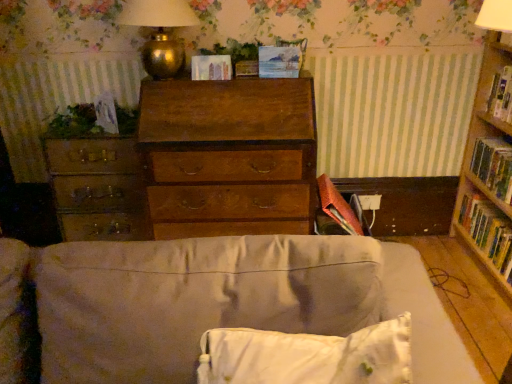
Question: Is white soft pillow at lower center taller than wooden file cabinet at left?

Choices:
 (A) yes
 (B) no

Answer: (B)

Question: Considering the relative sizes of white soft pillow at lower center and wooden file cabinet at left in the image provided, is white soft pillow at lower center bigger than wooden file cabinet at left?

Choices:
 (A) no
 (B) yes

Answer: (A)

Question: Is white soft pillow at lower center at the right side of wooden file cabinet at left?

Choices:
 (A) yes
 (B) no

Answer: (A)

Question: From the image's perspective, does white soft pillow at lower center appear lower than wooden file cabinet at left?

Choices:
 (A) yes
 (B) no

Answer: (A)

Question: Is white soft pillow at lower center to the left of wooden file cabinet at left from the viewer's perspective?

Choices:
 (A) yes
 (B) no

Answer: (B)

Question: In the image, is white soft pillow at lower center on the left side or the right side of wooden file cabinet at left?

Choices:
 (A) right
 (B) left

Answer: (A)

Question: From their relative heights in the image, would you say white soft pillow at lower center is taller or shorter than wooden file cabinet at left?

Choices:
 (A) tall
 (B) short

Answer: (B)

Question: Do you think white soft pillow at lower center is within wooden file cabinet at left, or outside of it?

Choices:
 (A) outside
 (B) inside

Answer: (A)

Question: From a real-world perspective, is white soft pillow at lower center physically located above or below wooden file cabinet at left?

Choices:
 (A) above
 (B) below

Answer: (A)

Question: From a real-world perspective, is gold metallic table lamp at upper center physically located above or below white soft pillow at lower center?

Choices:
 (A) above
 (B) below

Answer: (A)

Question: Is gold metallic table lamp at upper center situated inside white soft pillow at lower center or outside?

Choices:
 (A) inside
 (B) outside

Answer: (B)

Question: From the image's perspective, is gold metallic table lamp at upper center above or below white soft pillow at lower center?

Choices:
 (A) below
 (B) above

Answer: (B)

Question: From their relative heights in the image, would you say gold metallic table lamp at upper center is taller or shorter than white soft pillow at lower center?

Choices:
 (A) tall
 (B) short

Answer: (A)

Question: From the image's perspective, is matte paper at center, placed as the 2th paperback book when sorted from bottom to top, positioned above or below wooden chest of drawers at center?

Choices:
 (A) above
 (B) below

Answer: (A)

Question: From a real-world perspective, is matte paper at center, the second paperback book when ordered from top to bottom, positioned above or below wooden chest of drawers at center?

Choices:
 (A) above
 (B) below

Answer: (A)